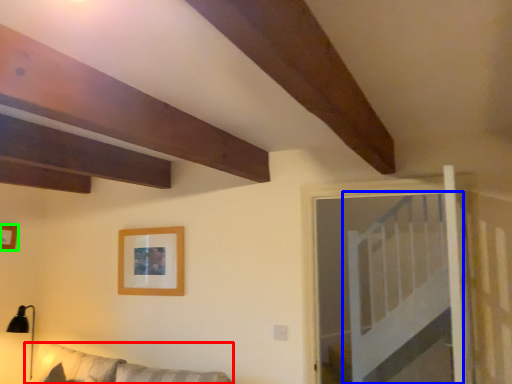
Question: Which is nearer to the couch (highlighted by a red box)? bed (highlighted by a blue box) or picture frame (highlighted by a green box).

Choices:
 (A) bed
 (B) picture frame

Answer: (B)